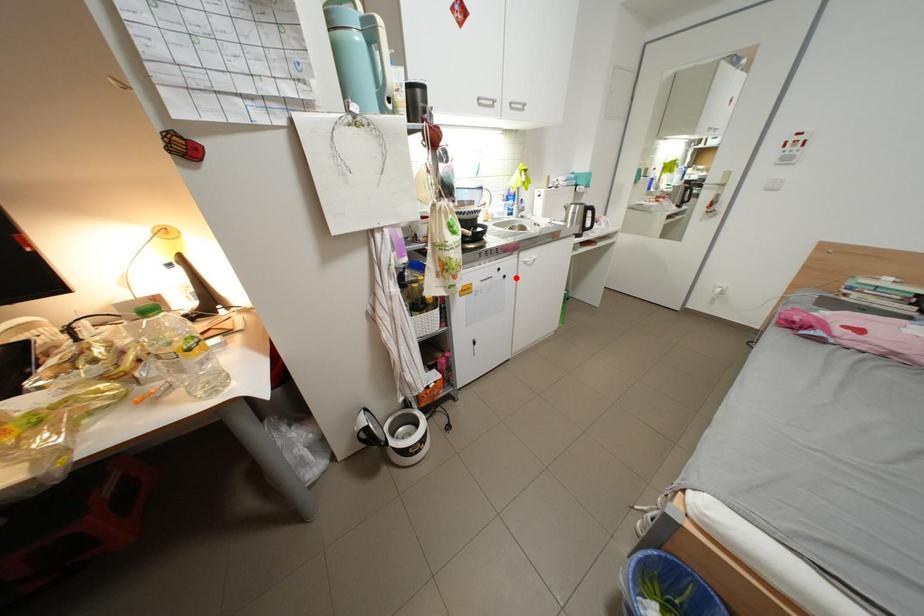
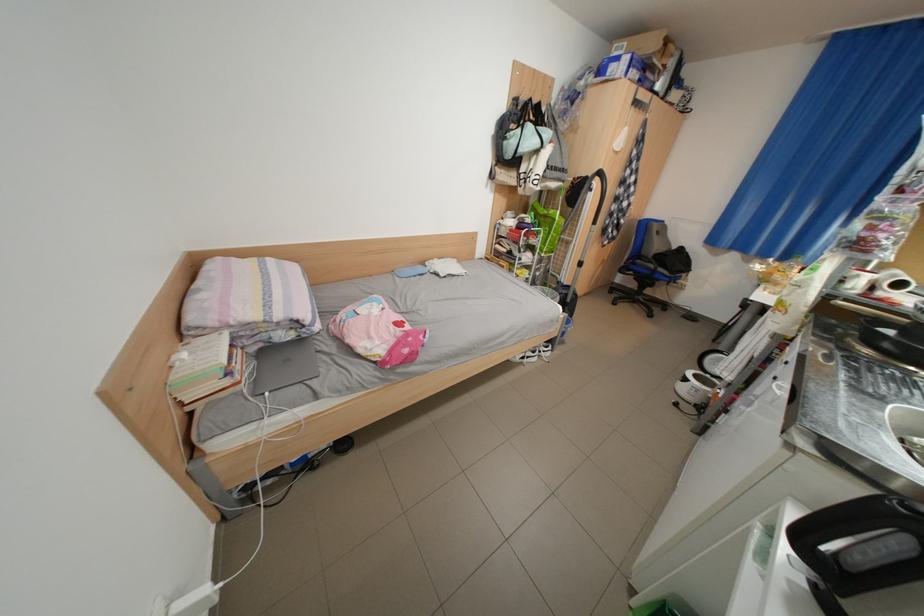
Where in the second image is the point corresponding to the highlighted location from the first image?

(786, 379)